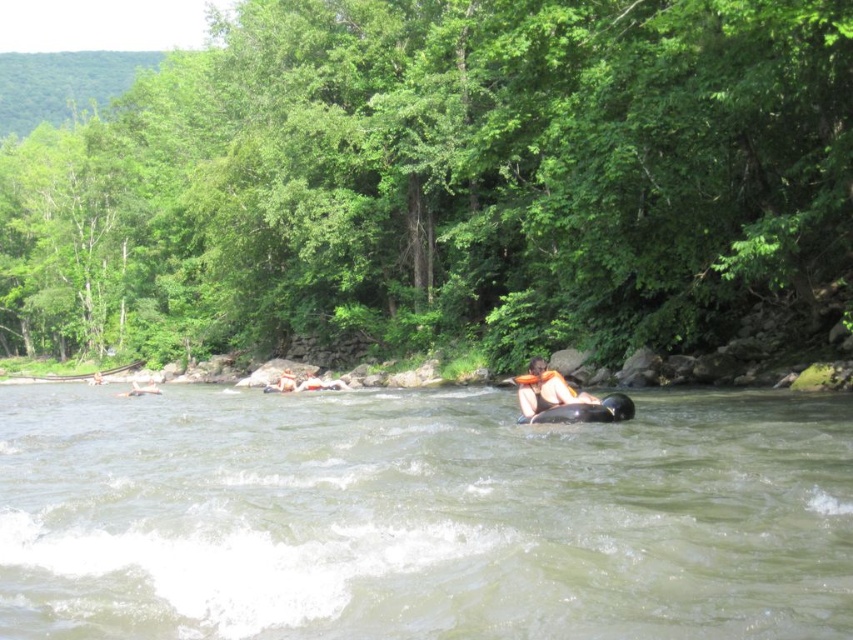
Question: Does black rubber tube at center have a lesser width compared to orange fabric life jacket at center?

Choices:
 (A) yes
 (B) no

Answer: (B)

Question: Which object is the farthest from the rubber black tube at center?

Choices:
 (A) orange life vest at center
 (B) black rubber tube at center

Answer: (B)

Question: Considering the relative positions of orange life vest at center and orange fabric life jacket at center in the image provided, where is orange life vest at center located with respect to orange fabric life jacket at center?

Choices:
 (A) left
 (B) right

Answer: (B)

Question: Which object is positioned closest to the black rubber tube at center?

Choices:
 (A) rubber black tube at center
 (B) orange fabric life jacket at center

Answer: (A)

Question: Which point is closer to the camera taking this photo?

Choices:
 (A) (527, 385)
 (B) (833, 596)
 (C) (630, 412)
 (D) (556, 385)

Answer: (B)

Question: In this image, where is black rubber tube at center located relative to rubber black tube at center?

Choices:
 (A) below
 (B) above

Answer: (A)